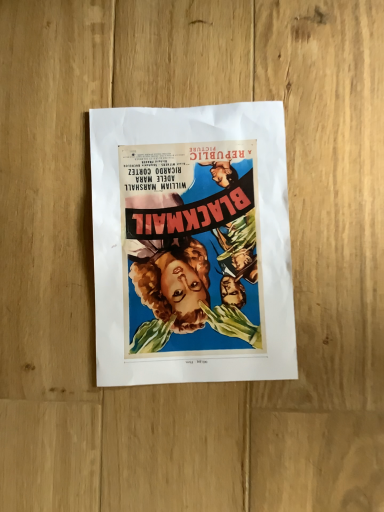
Image resolution: width=384 pixels, height=512 pixels. Identify the location of free location above matte paper poster at center (from a real-world perspective). (193, 243).